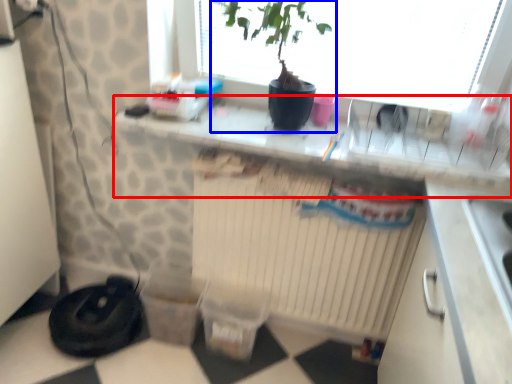
Question: Among these objects, which one is farthest to the camera, counter top (highlighted by a red box) or houseplant (highlighted by a blue box)?

Choices:
 (A) counter top
 (B) houseplant

Answer: (A)